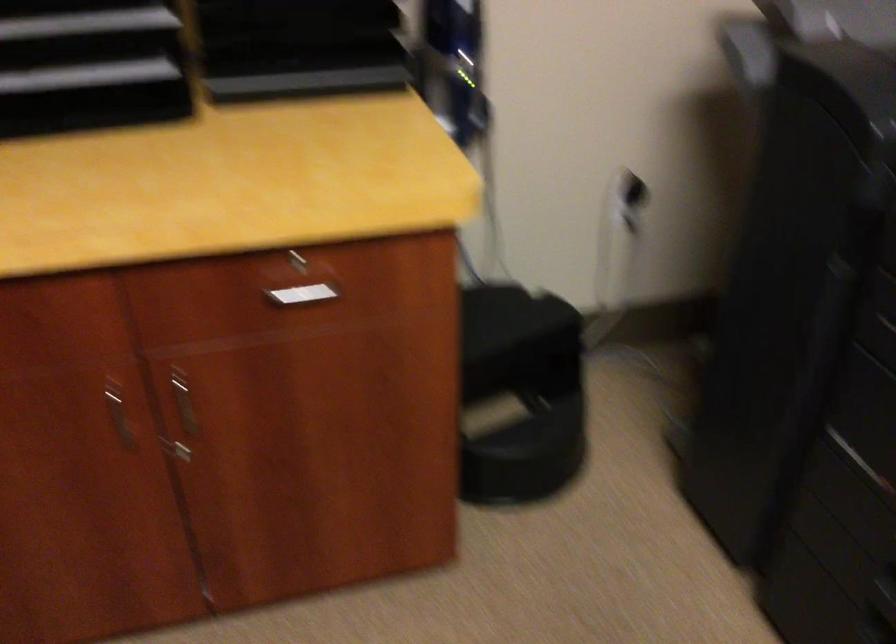
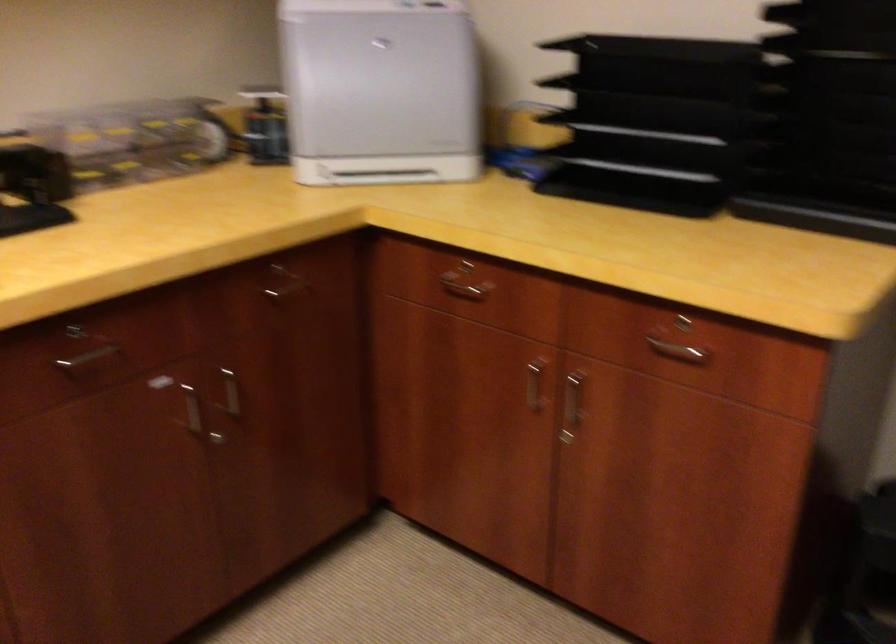
Where in the second image is the point corresponding to the point at 106,412 from the first image?

(533, 386)